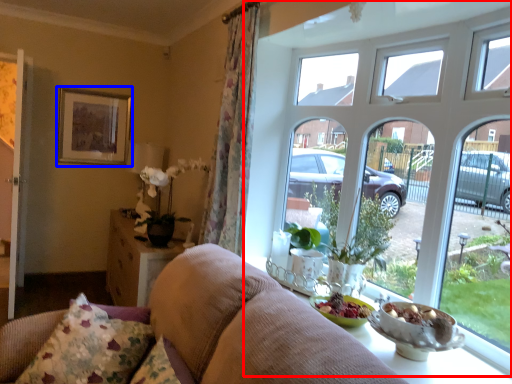
Question: Which object appears closest to the camera in this image, window (highlighted by a red box) or picture frame (highlighted by a blue box)?

Choices:
 (A) window
 (B) picture frame

Answer: (A)